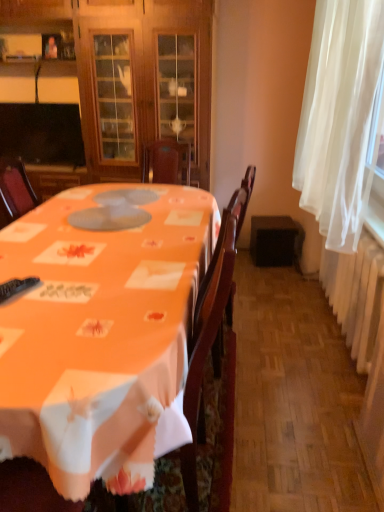
Question: In the image, is white sheer curtain at right positioned in front of or behind orange fabric table at center?

Choices:
 (A) behind
 (B) front

Answer: (A)

Question: From a real-world perspective, is white sheer curtain at right above or below orange fabric table at center?

Choices:
 (A) above
 (B) below

Answer: (A)

Question: Which is nearer to the black plastic remote control at lower left?

Choices:
 (A) orange fabric table at center
 (B) white sheer curtain at right
 (C) wooden cabinet at center

Answer: (A)

Question: Which object is the closest to the orange fabric table at center?

Choices:
 (A) wooden cabinet at center
 (B) black plastic remote control at lower left
 (C) white sheer curtain at right

Answer: (B)